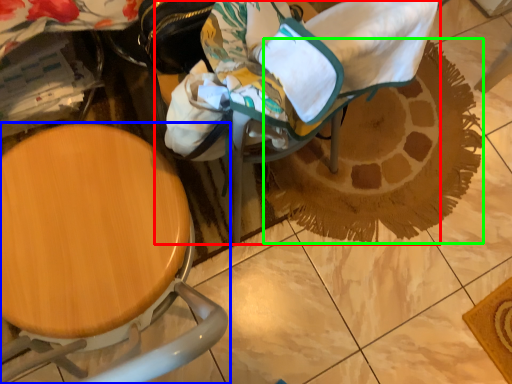
Question: Estimate the real-world distances between objects in this image. Which object is closer to baby carriage (highlighted by a red box), chair (highlighted by a blue box) or doormat (highlighted by a green box)?

Choices:
 (A) chair
 (B) doormat

Answer: (A)